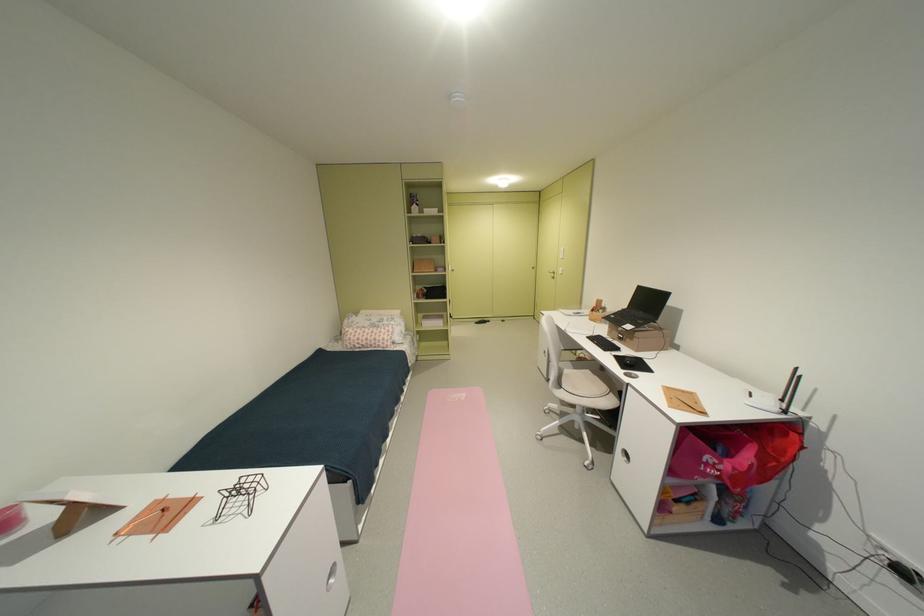
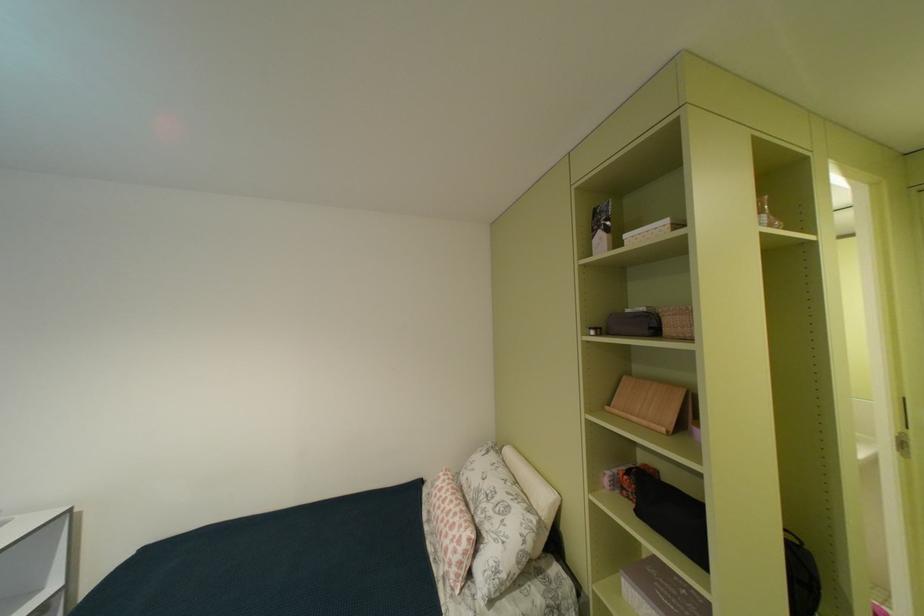
The point at [379,325] is marked in the first image. Where is the corresponding point in the second image?

(487, 487)